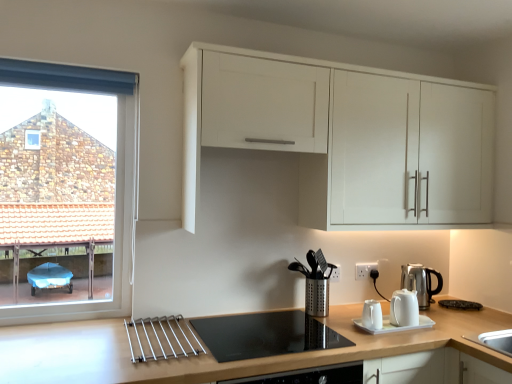
Question: From the image's perspective, does clear glass window at left appear higher than silver metallic kettle at right, which is the 2th kitchen appliance in left-to-right order?

Choices:
 (A) no
 (B) yes

Answer: (B)

Question: From a real-world perspective, is clear glass window at left on silver metallic kettle at right, which appears as the first kitchen appliance when viewed from the back?

Choices:
 (A) yes
 (B) no

Answer: (A)

Question: From the image's perspective, does clear glass window at left appear lower than silver metallic kettle at right, arranged as the second kitchen appliance when viewed from the front?

Choices:
 (A) no
 (B) yes

Answer: (A)

Question: Could you tell me if clear glass window at left is facing silver metallic kettle at right, arranged as the first kitchen appliance when viewed from the right?

Choices:
 (A) yes
 (B) no

Answer: (B)

Question: Is silver metallic kettle at right, arranged as the first kitchen appliance when viewed from the right, inside clear glass window at left?

Choices:
 (A) no
 (B) yes

Answer: (A)

Question: Does clear glass window at left lie behind silver metallic kettle at right, which appears as the first kitchen appliance when viewed from the back?

Choices:
 (A) yes
 (B) no

Answer: (B)

Question: Is white glossy teapot at center, which is the 2th kitchen appliance in back-to-front order, facing towards white plastic electric outlet at lower right?

Choices:
 (A) yes
 (B) no

Answer: (B)

Question: Is white glossy teapot at center, the first kitchen appliance when ordered from front to back, thinner than white plastic electric outlet at lower right?

Choices:
 (A) no
 (B) yes

Answer: (A)

Question: Considering the relative sizes of white glossy teapot at center, which is the 2th kitchen appliance in back-to-front order, and white plastic electric outlet at lower right in the image provided, is white glossy teapot at center, which is the 2th kitchen appliance in back-to-front order, smaller than white plastic electric outlet at lower right?

Choices:
 (A) yes
 (B) no

Answer: (B)

Question: Is white glossy teapot at center, the second kitchen appliance from the right, bigger than white plastic electric outlet at lower right?

Choices:
 (A) no
 (B) yes

Answer: (B)

Question: Would you say white glossy teapot at center, which is the 2th kitchen appliance in back-to-front order, contains white plastic electric outlet at lower right?

Choices:
 (A) no
 (B) yes

Answer: (A)

Question: From the image's perspective, does white glossy teapot at center, the second kitchen appliance from the right, appear higher than white plastic electric outlet at lower right?

Choices:
 (A) no
 (B) yes

Answer: (A)

Question: Does black glass cooktop at center have a greater height compared to silver metallic kettle at right, arranged as the second kitchen appliance when viewed from the front?

Choices:
 (A) no
 (B) yes

Answer: (A)